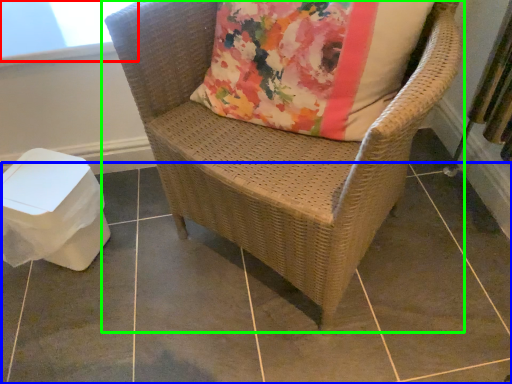
Question: Which object is positioned closest to window screen (highlighted by a red box)? Select from tile (highlighted by a blue box) and chair (highlighted by a green box).

Choices:
 (A) tile
 (B) chair

Answer: (B)